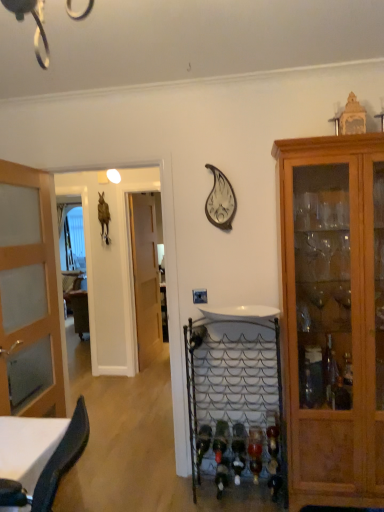
Question: Is metallic silver clock at upper center positioned behind translucent wood door at left, which is the first door from left to right?

Choices:
 (A) no
 (B) yes

Answer: (B)

Question: From the image's perspective, is metallic silver clock at upper center above translucent wood door at left, the 2th door viewed from the back?

Choices:
 (A) yes
 (B) no

Answer: (A)

Question: Can you confirm if metallic silver clock at upper center is thinner than translucent wood door at left, marked as the 1th door in a front-to-back arrangement?

Choices:
 (A) no
 (B) yes

Answer: (B)

Question: Is metallic silver clock at upper center shorter than translucent wood door at left, which is the first door from left to right?

Choices:
 (A) no
 (B) yes

Answer: (B)

Question: From a real-world perspective, is metallic silver clock at upper center over translucent wood door at left, positioned as the 2th door in right-to-left order?

Choices:
 (A) no
 (B) yes

Answer: (B)

Question: Based on their sizes in the image, would you say metallic silver clock at upper center is bigger or smaller than green glass wine bottle at lower center, which is counted as the first wine bottle, starting from the top?

Choices:
 (A) big
 (B) small

Answer: (A)

Question: Considering the positions of metallic silver clock at upper center and green glass wine bottle at lower center, acting as the first wine bottle starting from the left, in the image, is metallic silver clock at upper center taller or shorter than green glass wine bottle at lower center, acting as the first wine bottle starting from the left,?

Choices:
 (A) tall
 (B) short

Answer: (A)

Question: Considering the positions of metallic silver clock at upper center and green glass wine bottle at lower center, which is counted as the second wine bottle, starting from the right, in the image, is metallic silver clock at upper center wider or thinner than green glass wine bottle at lower center, which is counted as the second wine bottle, starting from the right,?

Choices:
 (A) wide
 (B) thin

Answer: (B)

Question: From the image's perspective, is metallic silver clock at upper center located above or below green glass wine bottle at lower center, placed as the 2th wine bottle when sorted from bottom to top?

Choices:
 (A) above
 (B) below

Answer: (A)

Question: From a real-world perspective, relative to metallic wire wine rack at center, is green glass wine bottle at lower center, acting as the first wine bottle starting from the left, vertically above or below?

Choices:
 (A) below
 (B) above

Answer: (A)

Question: From their relative heights in the image, would you say green glass wine bottle at lower center, acting as the first wine bottle starting from the left, is taller or shorter than metallic wire wine rack at center?

Choices:
 (A) tall
 (B) short

Answer: (B)

Question: Is green glass wine bottle at lower center, placed as the 2th wine bottle when sorted from bottom to top, wider or thinner than metallic wire wine rack at center?

Choices:
 (A) thin
 (B) wide

Answer: (B)

Question: Looking at the image, does green glass wine bottle at lower center, which is counted as the first wine bottle, starting from the top, seem bigger or smaller compared to metallic wire wine rack at center?

Choices:
 (A) small
 (B) big

Answer: (A)

Question: Considering their positions, is metallic wire wine rack at center located in front of or behind green glass wine bottle at lower center, which is counted as the second wine bottle, starting from the right?

Choices:
 (A) front
 (B) behind

Answer: (A)

Question: Considering the positions of metallic wire wine rack at center and green glass wine bottle at lower center, which is counted as the first wine bottle, starting from the top, in the image, is metallic wire wine rack at center wider or thinner than green glass wine bottle at lower center, which is counted as the first wine bottle, starting from the top,?

Choices:
 (A) thin
 (B) wide

Answer: (A)